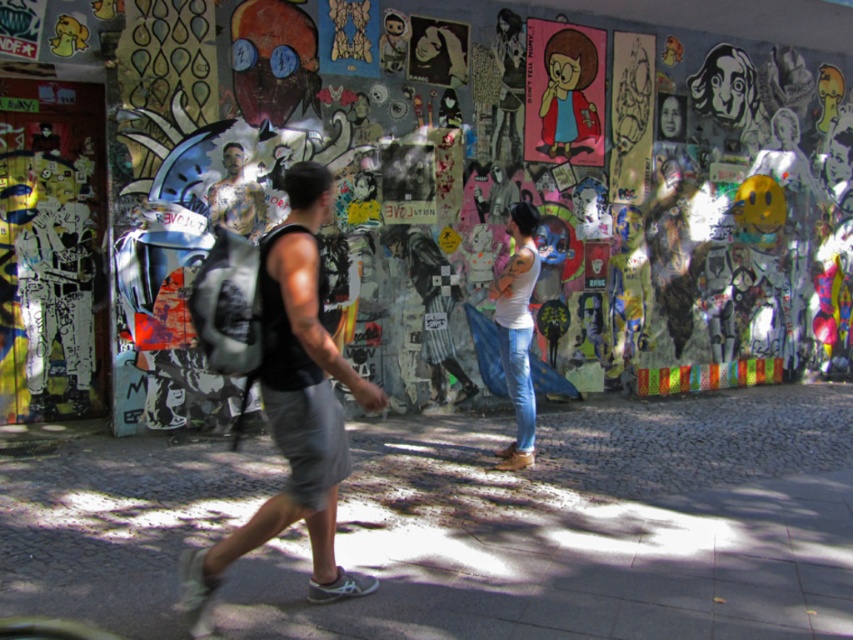
You are a delivery person who needs to choose a backpack to carry heavy packages. You see a matte black backpack at left and a black fabric backpack at center. Which backpack should you choose based on their sizes?

The matte black backpack at left is larger in size than the black fabric backpack at center, so you should choose the matte black backpack at left for carrying heavy packages.